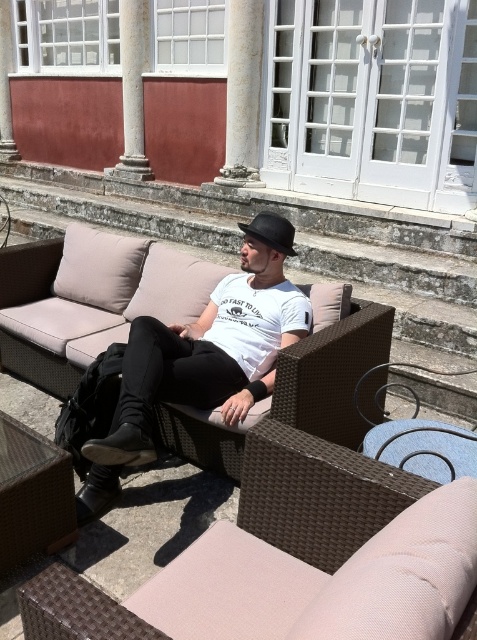
You are standing at the point with coordinates point (32, 496) and want to move to the man sitting on the wicker sofa. Which direction should you go to reach him?

The point (32, 496) is located on the brown wicker side table at lower left, so to reach the man sitting on the wicker sofa, you should move towards the upper right direction.